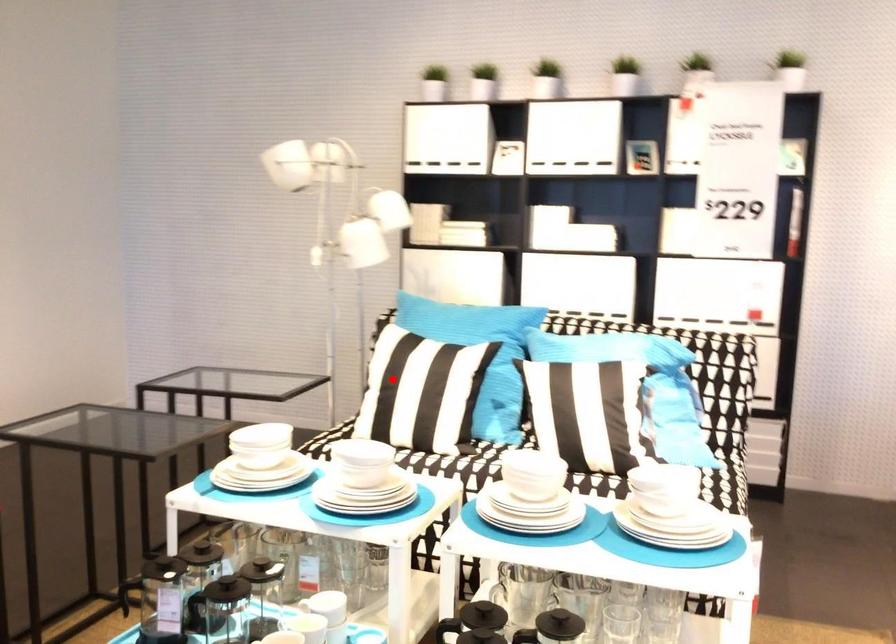
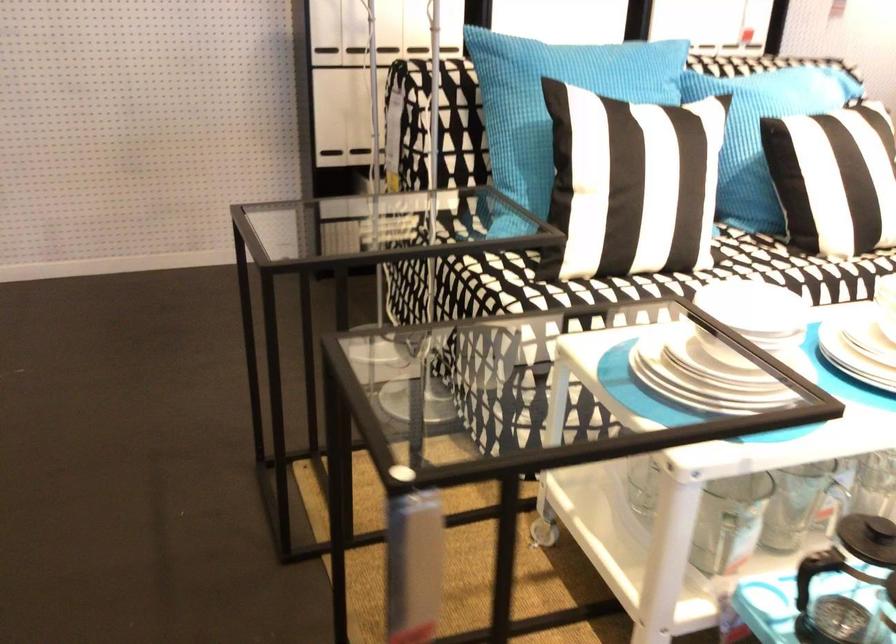
Locate, in the second image, the point that corresponds to the highlighted location in the first image.

(617, 180)